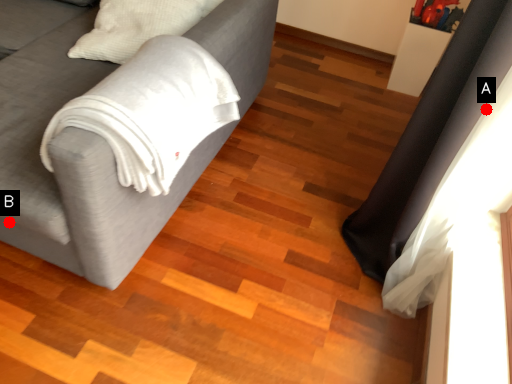
Question: Two points are circled on the image, labeled by A and B beside each circle. Among these points, which one is nearest to the camera?

Choices:
 (A) A is closer
 (B) B is closer

Answer: (A)